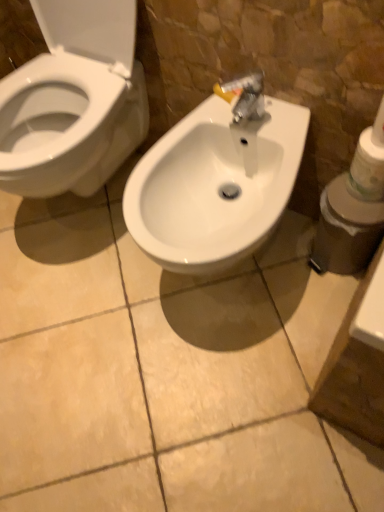
At what (x,y) coordinates should I click in order to perform the action: click on free space above white plastic container at right (from a real-world perspective). Please return your answer as a coordinate pair (x, y). Looking at the image, I should click on click(355, 201).